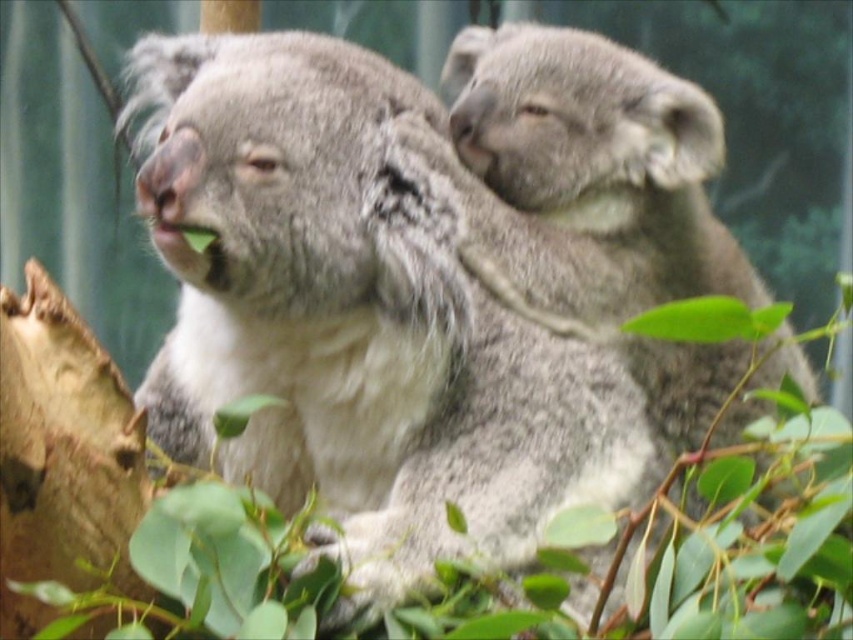
You are a zookeeper observing the koalas in their enclosure. You notice the gray furry koala at center and the fuzzy gray koala at upper right. Which of these two koalas is closer to you?

The gray furry koala at center is closer to you because it is in front of the fuzzy gray koala at upper right.

You are a wildlife photographer aiming to capture both the gray furry koala at center and the fuzzy gray koala at upper right in a single frame. Based on their sizes, which koala would you need to position closer to the camera to ensure both fit within the frame?

The gray furry koala at center is wider than the fuzzy gray koala at upper right, so positioning the wider gray furry koala at center closer to the camera would help ensure both fit within the frame by adjusting their apparent sizes.

You are a wildlife photographer aiming to capture a closeup shot of the gray furry koala at center and the fuzzy gray koala at upper right. Your camera has a maximum focus range of 10 inches. Can you photograph both koalas without moving your position?

The gray furry koala at center is 9.24 inches from the fuzzy gray koala at upper right. Since the distance between them is within the camera maximum focus range of 10 inches, you can photograph both koalas without moving your position.